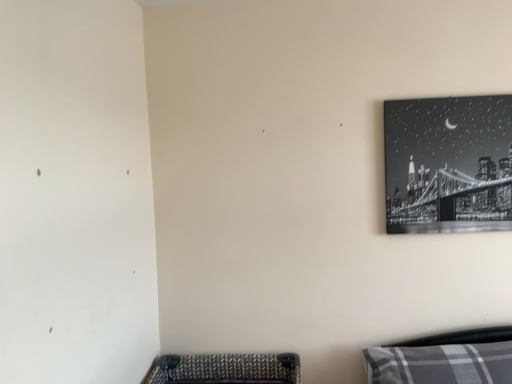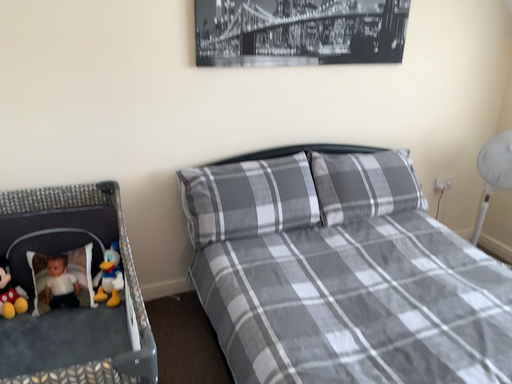
Question: How did the camera likely rotate when shooting the video?

Choices:
 (A) rotated left
 (B) rotated right

Answer: (B)